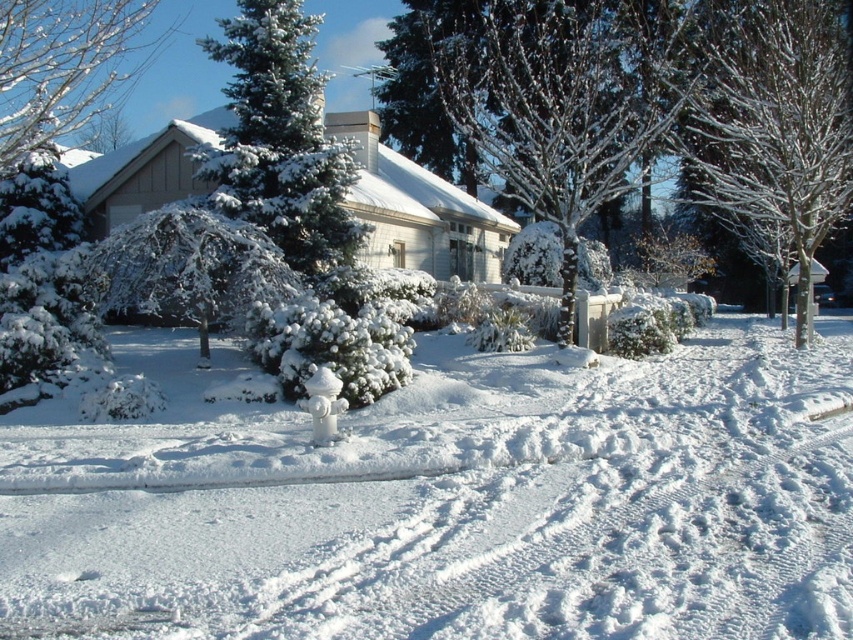
Question: Which object is closer to the camera taking this photo?

Choices:
 (A) white fluffy snow at center
 (B) frosty bark tree at center
 (C) white snow-covered tree at upper right

Answer: (A)

Question: Does white fluffy snow at center have a smaller size compared to white snow-covered tree at upper right?

Choices:
 (A) no
 (B) yes

Answer: (B)

Question: From the image, what is the correct spatial relationship of frosty bark tree at center in relation to green snow-covered evergreen at center?

Choices:
 (A) left
 (B) right

Answer: (B)

Question: Estimate the real-world distances between objects in this image. Which object is farther from the frosty bark tree at center?

Choices:
 (A) white fluffy snow at center
 (B) white snow-covered tree at upper right
 (C) green snow-covered evergreen at center

Answer: (A)

Question: Which point is closer to the camera taking this photo?

Choices:
 (A) (283, 257)
 (B) (468, 120)

Answer: (A)

Question: Does white fluffy snow at center have a lesser width compared to frosty bark tree at center?

Choices:
 (A) no
 (B) yes

Answer: (A)